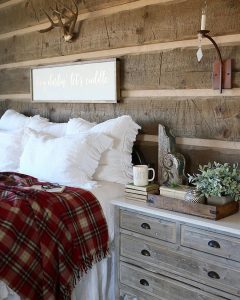
Image resolution: width=240 pixels, height=300 pixels. Find the location of `bed above wall on picture`. bed above wall on picture is located at coordinates (71, 80).